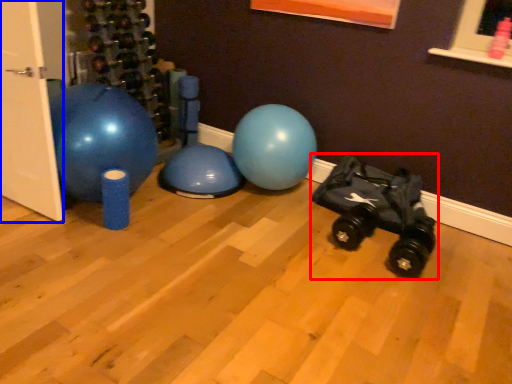
Question: Which point is closer to the camera, baby carriage (highlighted by a red box) or door (highlighted by a blue box)?

Choices:
 (A) baby carriage
 (B) door

Answer: (B)